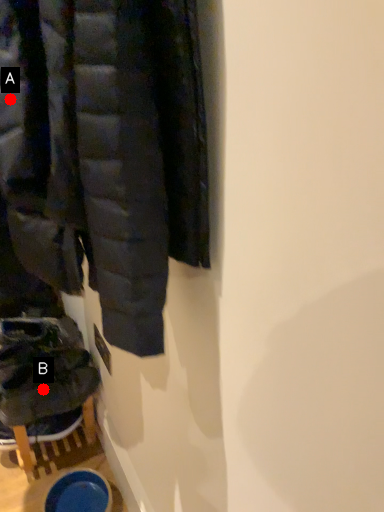
Question: Two points are circled on the image, labeled by A and B beside each circle. Which of the following is the farthest from the observer?

Choices:
 (A) A is further
 (B) B is further

Answer: (B)